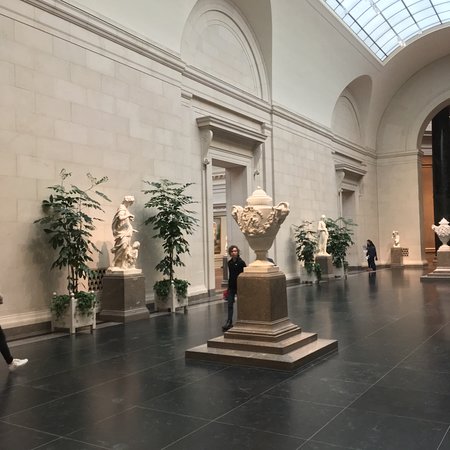
Identify the location of doorway. This screenshot has width=450, height=450. [221, 169], [346, 199].